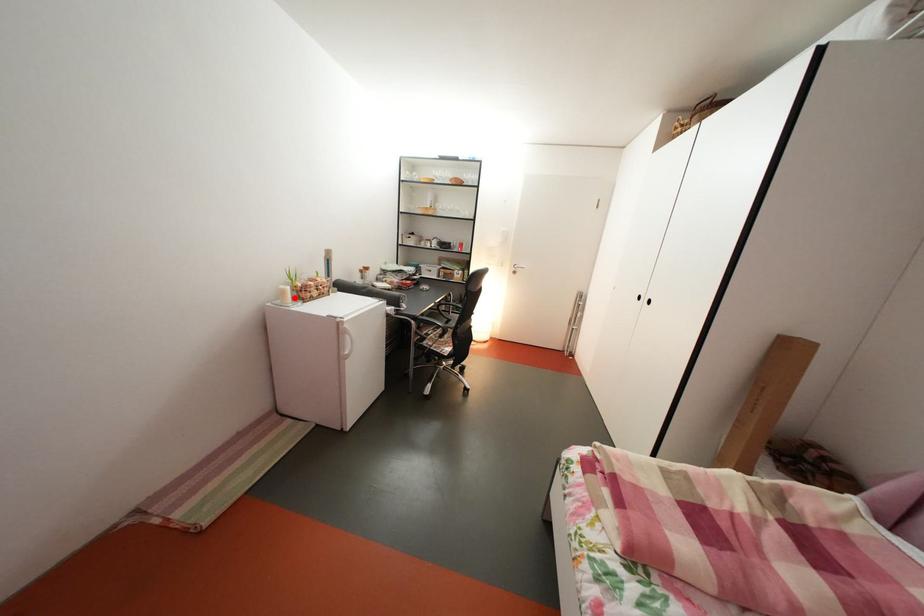
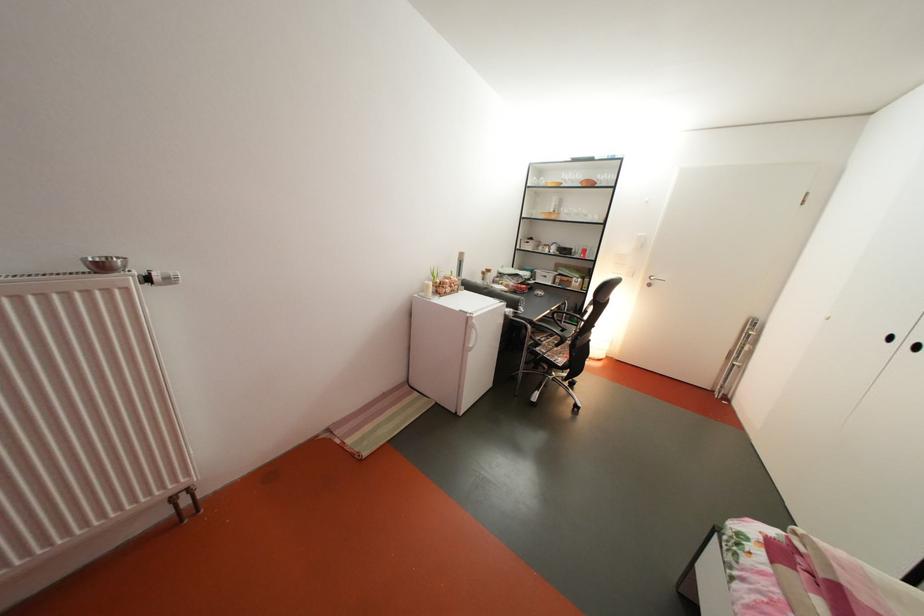
Find the pixel in the second image that matches the highlighted location in the first image.

(439, 293)